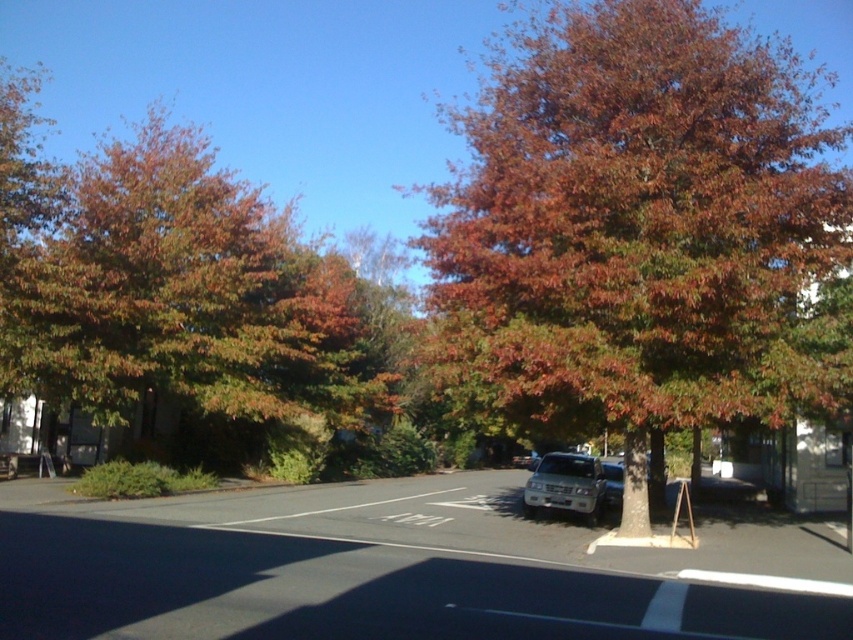
Is orange-brown foliage at left closer to camera compared to silver metallic suv at center?

That is True.

Describe the element at coordinates (167, 285) in the screenshot. I see `orange-brown foliage at left` at that location.

Where is `orange-brown foliage at left`? Image resolution: width=853 pixels, height=640 pixels. orange-brown foliage at left is located at coordinates (167, 285).

Can you confirm if reddish-brown bark tree at center is wider than orange-brown foliage at left?

Yes, reddish-brown bark tree at center is wider than orange-brown foliage at left.

Who is positioned more to the left, reddish-brown bark tree at center or orange-brown foliage at left?

orange-brown foliage at left

What do you see at coordinates (636, 221) in the screenshot? The width and height of the screenshot is (853, 640). I see `reddish-brown bark tree at center` at bounding box center [636, 221].

Locate an element on the screen. reddish-brown bark tree at center is located at coordinates (636, 221).

Does silver metallic suv at center have a lesser width compared to satin silver sedan at center?

Yes, silver metallic suv at center is thinner than satin silver sedan at center.

Does silver metallic suv at center appear on the right side of satin silver sedan at center?

No, silver metallic suv at center is not to the right of satin silver sedan at center.

The width and height of the screenshot is (853, 640). Describe the element at coordinates (566, 484) in the screenshot. I see `silver metallic suv at center` at that location.

Where is `silver metallic suv at center`? The height and width of the screenshot is (640, 853). silver metallic suv at center is located at coordinates (566, 484).